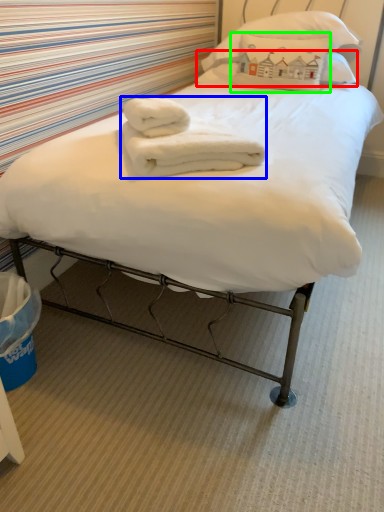
Question: Which object is the closest to the pillow (highlighted by a red box)? Choose among these: bath towel (highlighted by a blue box) or pillow (highlighted by a green box).

Choices:
 (A) bath towel
 (B) pillow

Answer: (B)